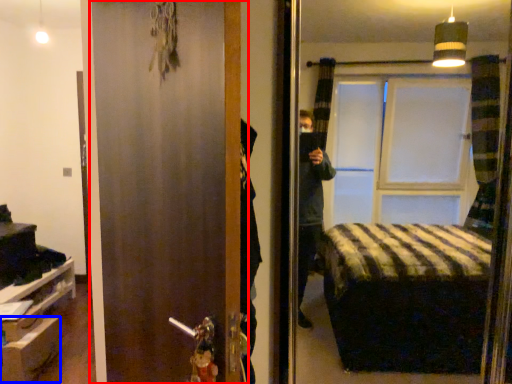
Question: Which object appears farthest to the camera in this image, door (highlighted by a red box) or drawer (highlighted by a blue box)?

Choices:
 (A) door
 (B) drawer

Answer: (B)